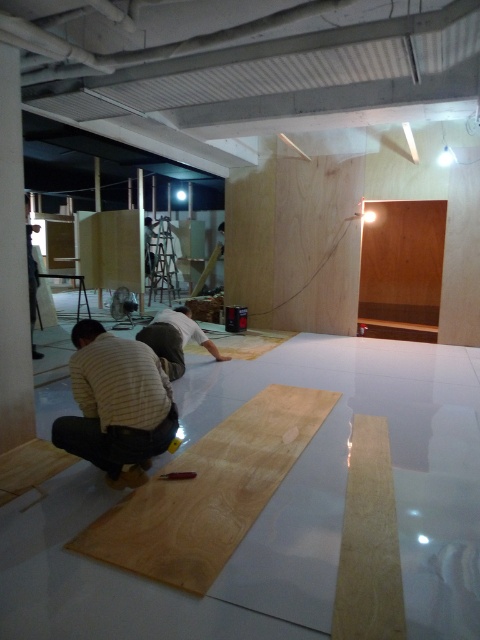
Is natural wood plywood at lower left bigger than light wood plank at center?

Yes.

Between natural wood plywood at lower left and light wood plank at center, which one appears on the left side from the viewer's perspective?

Positioned to the left is natural wood plywood at lower left.

Does point (137, 492) lie behind point (377, 438)?

That is False.

Find the location of `natural wood plywood at lower left`. natural wood plywood at lower left is located at coordinates (208, 492).

Is natural wood plywood at lower left to the right of wooden plank at center from the viewer's perspective?

Correct, you'll find natural wood plywood at lower left to the right of wooden plank at center.

Who is shorter, natural wood plywood at lower left or wooden plank at center?

wooden plank at center is shorter.

Describe the element at coordinates (208, 492) in the screenshot. I see `natural wood plywood at lower left` at that location.

Find the location of a particular element. natural wood plywood at lower left is located at coordinates (208, 492).

Between point (381, 636) and point (188, 472), which one is positioned in front?

Point (381, 636) is more forward.

Is light wood plank at center further to the viewer compared to wooden plank at center?

No.

The width and height of the screenshot is (480, 640). Find the location of `light wood plank at center`. light wood plank at center is located at coordinates (369, 541).